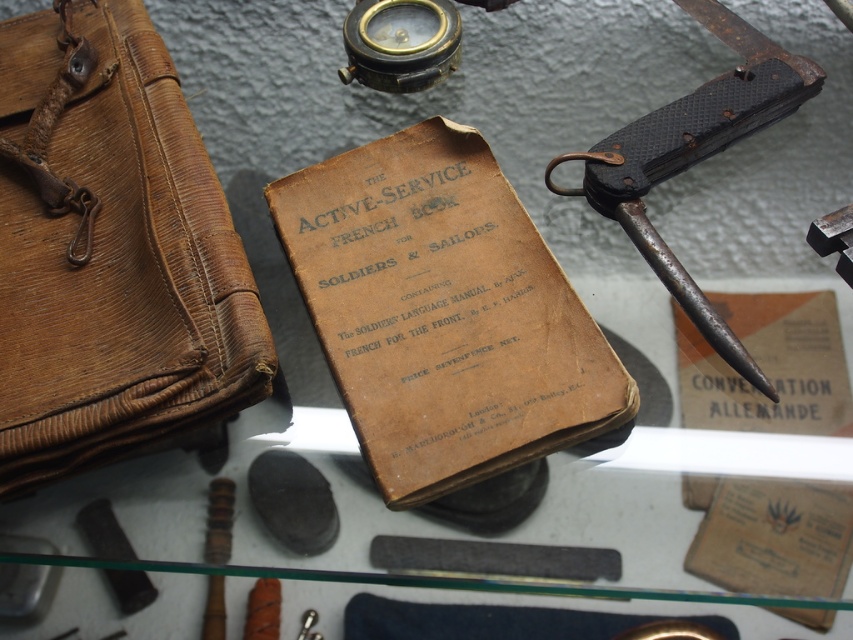
You are a museum curator arranging an exhibit. You have a brown leather briefcase at left and a rusty metal knife at right. Which object is taller?

The brown leather briefcase at left is taller than the rusty metal knife at right.

You are a museum curator arranging an exhibit. You have a brown leather briefcase at left and a rusty metal knife at right. Based on their sizes, which object would require more horizontal space on the display shelf?

The brown leather briefcase at left might be wider than the rusty metal knife at right, so it would require more horizontal space on the display shelf.

You are a museum curator planning to rearrange the display. The brown leather briefcase at left and the rusty metal knife at right are currently 57.56 centimeters apart. If you want to place them closer together to save space, what is the minimum distance you can move them to while maintaining a 10 centimeter gap between them?

The minimum distance you can move the brown leather briefcase at left and the rusty metal knife at right to while maintaining a 10 centimeter gap is 57.56 centimeters minus 10 centimeters, which equals 47.56 centimeters apart.